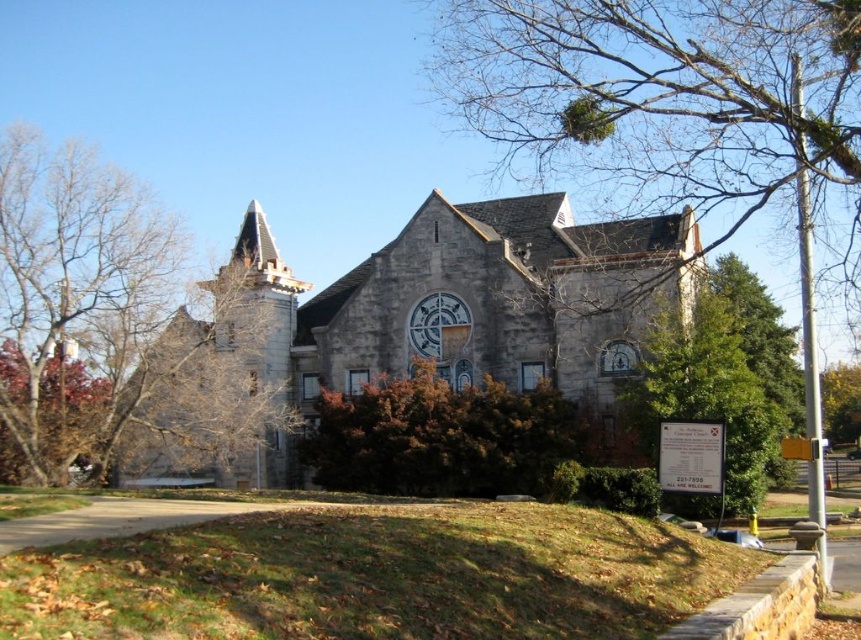
You are standing in front of the historic stone church and want to take a photo that includes both the brown textured stone tower at upper left and the green leafy tree at center right. Which object should you position higher in your camera frame to ensure both are fully visible?

You should position the brown textured stone tower at upper left higher in your camera frame since it is above the green leafy tree at center right in the scene.

You are standing in front of the historic stone church and want to take a photo that includes both the brown textured stone tower at upper left and the green leafy tree at center right. Which object should you position closer to the edge of the frame to ensure both are fully visible?

The brown textured stone tower at upper left might be wider than the green leafy tree at center right, so to ensure both are fully visible in the photo, position the tower closer to the edge of the frame to accommodate its potential width.

You are standing in front of the historic stone church and want to take a photo that includes both the green leafy tree at right and the stone clock at center. Which object will appear taller in your photo?

The green leafy tree at right will appear taller in the photo because it has a greater height compared to the stone clock at center.